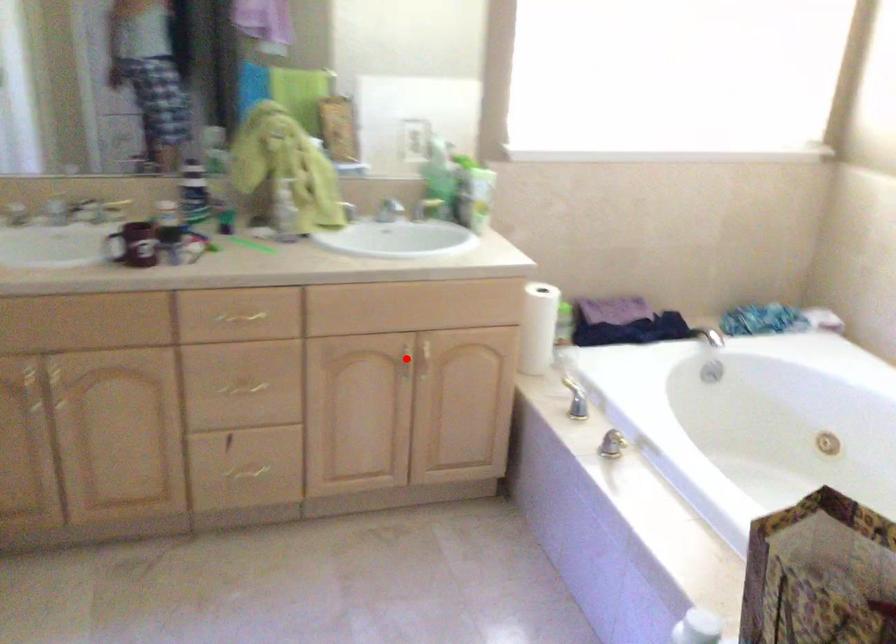
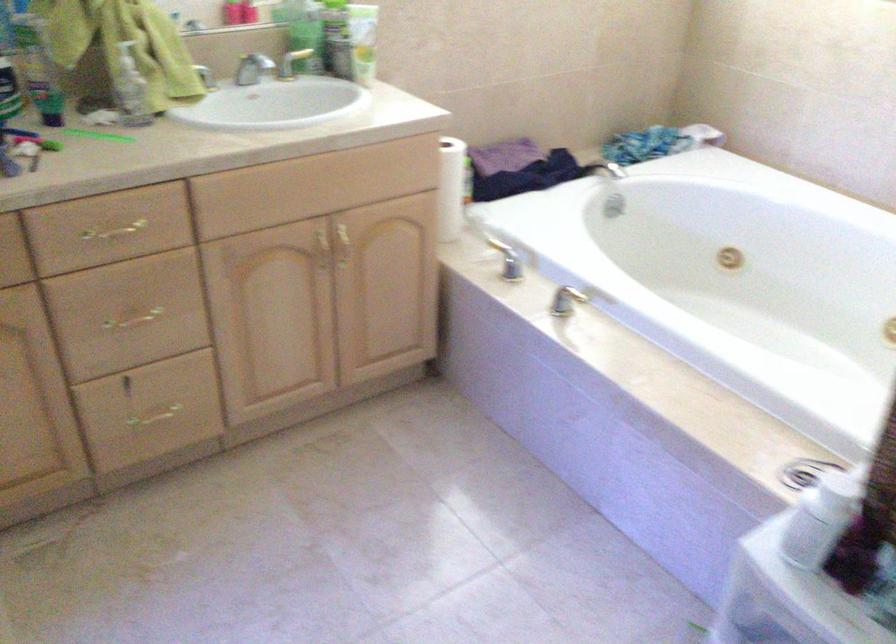
Question: A red point is marked in image1. In image2, is the corresponding 3D point closer to the camera or farther? Reply with the corresponding letter.

Choices:
 (A) The corresponding 3D point is closer.
 (B) The corresponding 3D point is farther.

Answer: (A)